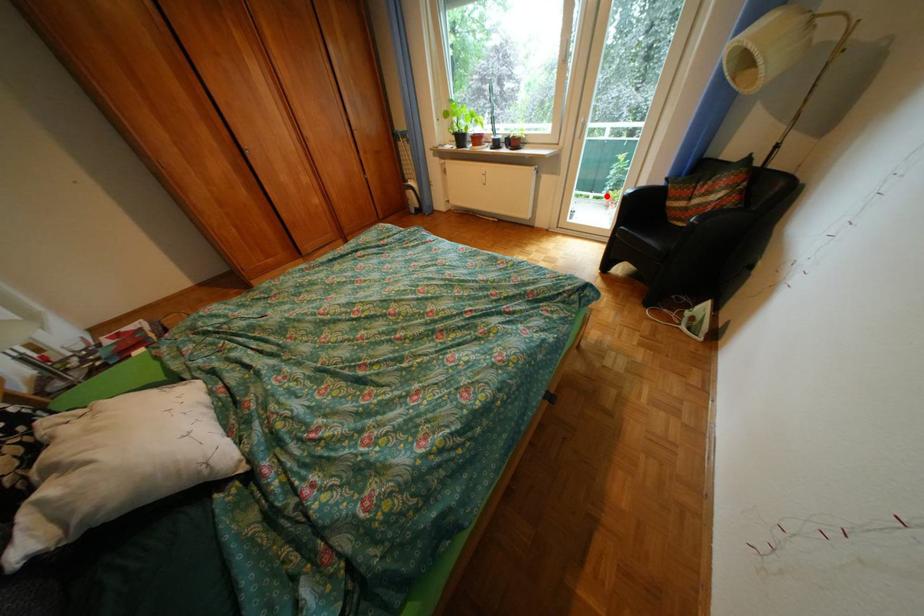
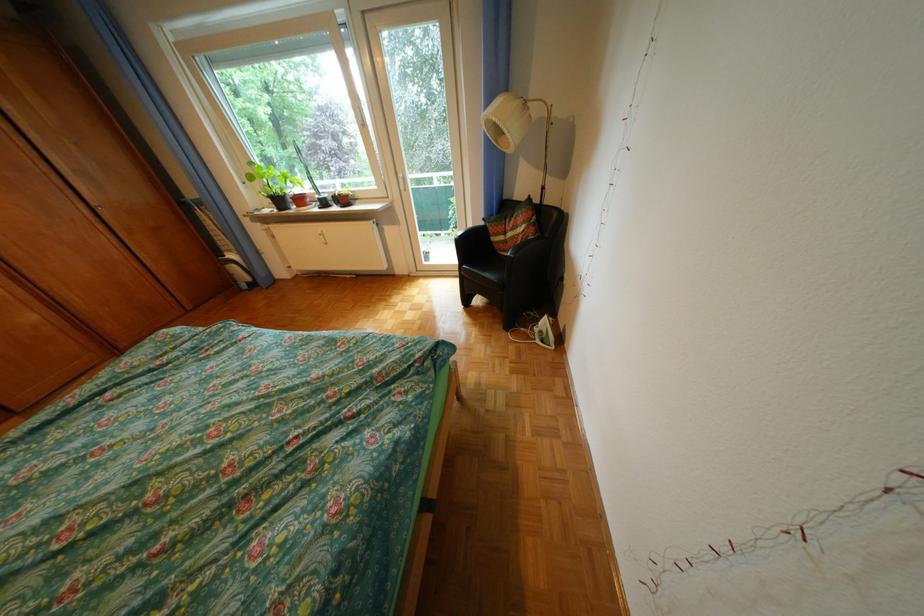
Where in the second image is the point corresponding to the highlighted location from the first image?

(457, 233)